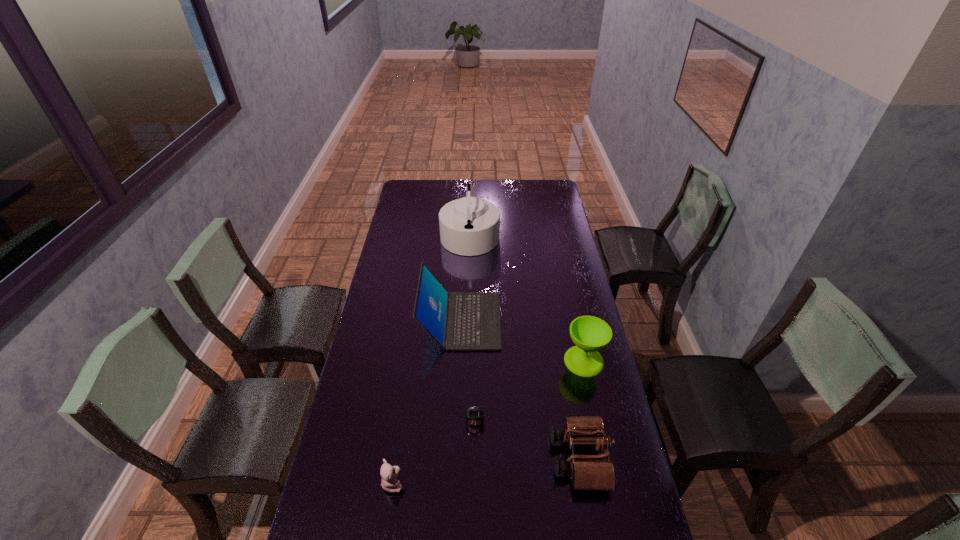
Locate an element on the screen. The image size is (960, 540). vacant space situated through the eyepieces of the binoculars is located at coordinates (420, 458).

I want to click on vacant position located through the eyepieces of the binoculars, so click(x=417, y=458).

Find the location of a particular element. This screenshot has height=540, width=960. vacant space located 0.380m through the eyepieces of the binoculars is located at coordinates (423, 458).

Find the location of a particular element. The height and width of the screenshot is (540, 960). free space located 0.370m at the face of the teddy bear is located at coordinates (535, 483).

Identify the location of free region located on the front of the padlock near the keyhole. The image size is (960, 540). (474, 455).

Image resolution: width=960 pixels, height=540 pixels. Identify the location of object present at the left edge. click(x=389, y=474).

Locate an element on the screen. The height and width of the screenshot is (540, 960). wineglass that is at the right edge is located at coordinates pos(590,334).

The width and height of the screenshot is (960, 540). Identify the location of binoculars that is at the right edge. (588, 472).

In the image, there is a desktop. Where is `free space at the far edge`? The width and height of the screenshot is (960, 540). free space at the far edge is located at coordinates (467, 185).

You are a GUI agent. You are given a task and a screenshot of the screen. Output one action in this format:
    pyautogui.click(x=<x>, y=<y>)
    Task: Click on the vacant space at the left edge
    
    Given the screenshot: What is the action you would take?
    pyautogui.click(x=393, y=403)